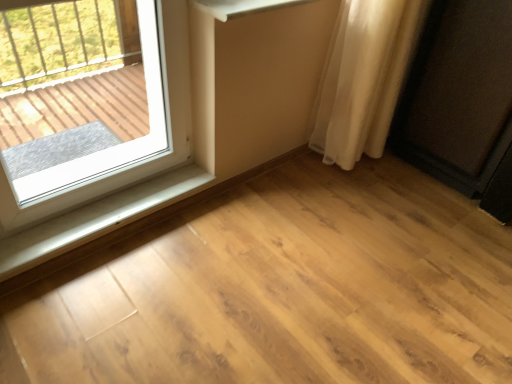
Question: From the image's perspective, is white plastic window at upper left located above matte black speaker at right?

Choices:
 (A) no
 (B) yes

Answer: (A)

Question: Is white plastic window at upper left behind matte black speaker at right?

Choices:
 (A) no
 (B) yes

Answer: (A)

Question: Can you confirm if white plastic window at upper left is taller than matte black speaker at right?

Choices:
 (A) no
 (B) yes

Answer: (A)

Question: Is white plastic window at upper left wider than matte black speaker at right?

Choices:
 (A) no
 (B) yes

Answer: (A)

Question: From the image's perspective, is white plastic window at upper left under matte black speaker at right?

Choices:
 (A) no
 (B) yes

Answer: (B)

Question: Is matte black speaker at right taller or shorter than white plastic window sill at lower left?

Choices:
 (A) short
 (B) tall

Answer: (B)

Question: Is matte black speaker at right inside or outside of white plastic window sill at lower left?

Choices:
 (A) outside
 (B) inside

Answer: (A)

Question: In terms of width, does matte black speaker at right look wider or thinner when compared to white plastic window sill at lower left?

Choices:
 (A) wide
 (B) thin

Answer: (A)

Question: Based on their positions, is matte black speaker at right located to the left or right of white plastic window sill at lower left?

Choices:
 (A) right
 (B) left

Answer: (A)

Question: Which is correct: white sheer curtain at right is inside matte black speaker at right, or outside of it?

Choices:
 (A) outside
 (B) inside

Answer: (A)

Question: From the image's perspective, is white sheer curtain at right located above or below matte black speaker at right?

Choices:
 (A) below
 (B) above

Answer: (B)

Question: Is point (379, 23) closer or farther from the camera than point (412, 153)?

Choices:
 (A) farther
 (B) closer

Answer: (B)

Question: Considering the relative positions of white sheer curtain at right and matte black speaker at right in the image provided, is white sheer curtain at right to the left or to the right of matte black speaker at right?

Choices:
 (A) left
 (B) right

Answer: (A)

Question: In terms of height, does white plastic window at upper left look taller or shorter compared to white plastic window sill at lower left?

Choices:
 (A) tall
 (B) short

Answer: (A)

Question: Considering the positions of point (36, 185) and point (133, 200), is point (36, 185) closer or farther from the camera than point (133, 200)?

Choices:
 (A) closer
 (B) farther

Answer: (A)